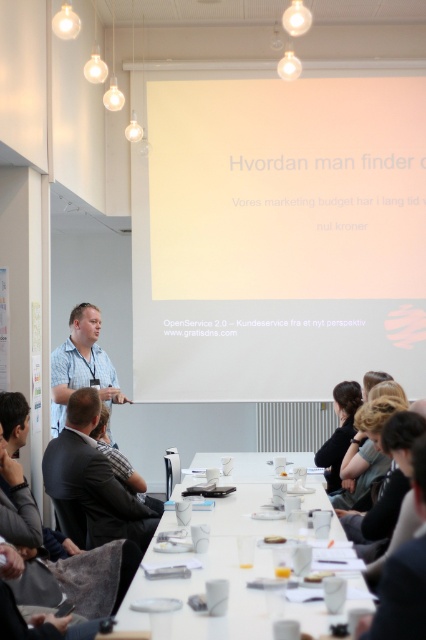
Which is in front, point (91, 403) or point (85, 364)?

Point (91, 403) is more forward.

Locate an element on the screen. dark gray suit at lower left is located at coordinates (91, 483).

Between point (86, 483) and point (65, 371), which one is positioned behind?

Positioned behind is point (65, 371).

Identify the location of dark gray suit at lower left. (91, 483).

Does white matte projector screen at upper center have a smaller size compared to blue checkered shirt at left?

Actually, white matte projector screen at upper center might be larger than blue checkered shirt at left.

Who is positioned more to the left, white matte projector screen at upper center or blue checkered shirt at left?

Positioned to the left is blue checkered shirt at left.

Is point (402, 269) farther from camera compared to point (74, 312)?

That is True.

Find the location of a particular element. Image resolution: width=426 pixels, height=640 pixels. white matte projector screen at upper center is located at coordinates (279, 230).

Who is more distant from viewer, (259, 461) or (94, 452)?

Point (259, 461)

Which is below, white glossy table at center or dark gray suit at lower left?

white glossy table at center is below.

The height and width of the screenshot is (640, 426). In order to click on white glossy table at center in this screenshot , I will do `click(219, 564)`.